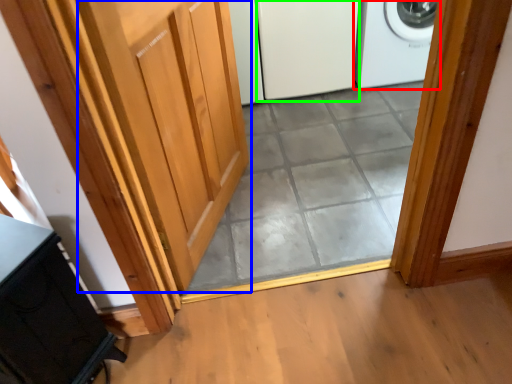
Question: Considering the real-world distances, which object is farthest from home appliance (highlighted by a red box)? door (highlighted by a blue box) or screen door (highlighted by a green box)?

Choices:
 (A) door
 (B) screen door

Answer: (A)